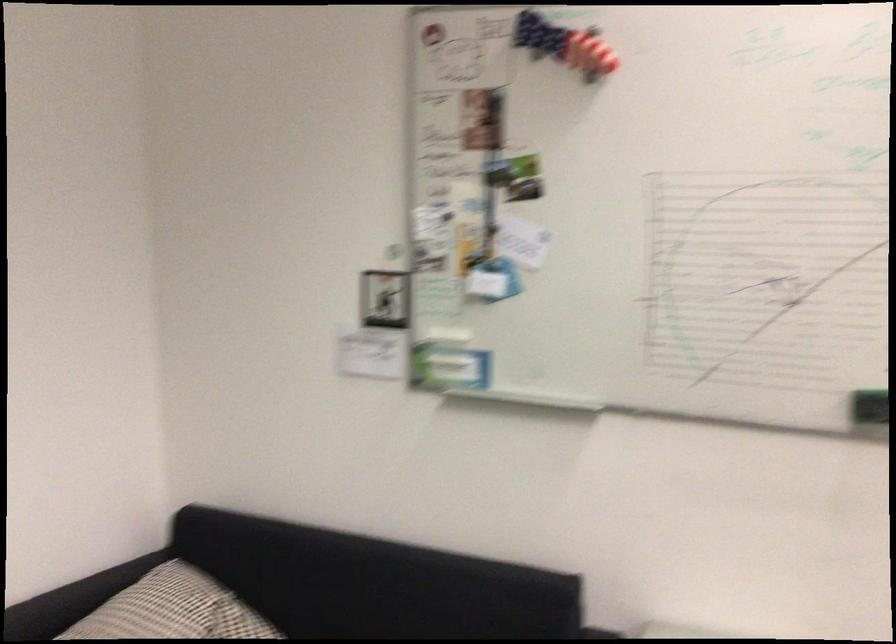
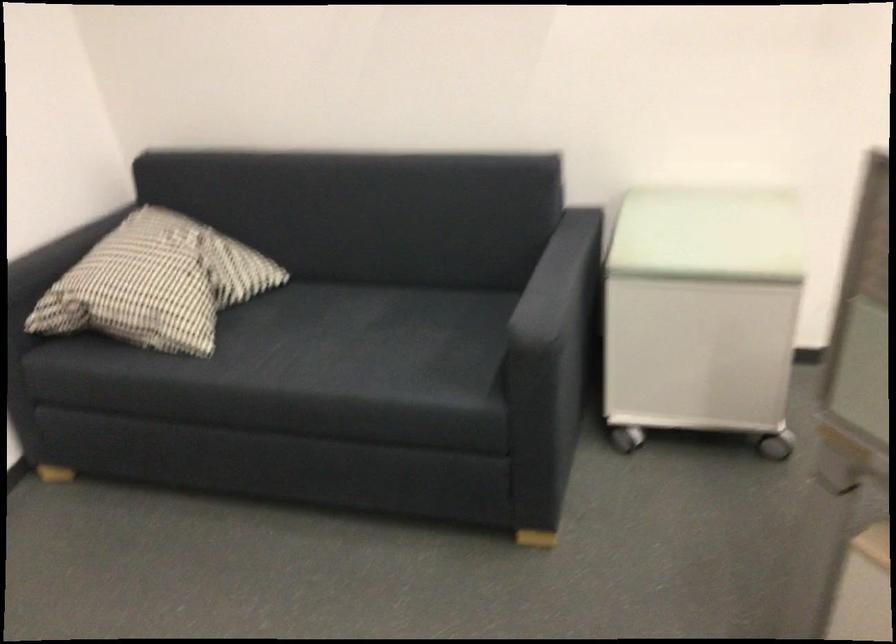
Which direction would the cameraman need to move to produce the second image?

The movement direction of the cameraman is left, forward.